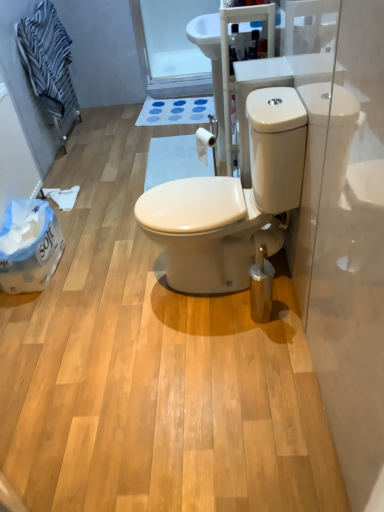
At what (x,y) coordinates should I click in order to perform the action: click on white matte toilet paper at upper center. Please return your answer as a coordinate pair (x, y). The width and height of the screenshot is (384, 512). Looking at the image, I should click on (204, 143).

This screenshot has height=512, width=384. What do you see at coordinates (204, 143) in the screenshot?
I see `white matte toilet paper at upper center` at bounding box center [204, 143].

Image resolution: width=384 pixels, height=512 pixels. In order to click on white plastic bag at left in this screenshot , I will do `click(29, 246)`.

Find the location of a particular element. This screenshot has width=384, height=512. blue rubber bath mat at center is located at coordinates (176, 111).

What is the approximate width of blue striped towel at upper left?

The width of blue striped towel at upper left is 6.80 inches.

The height and width of the screenshot is (512, 384). In order to click on white glossy toilet at center in this screenshot , I will do `click(231, 204)`.

Is white matte toilet paper at upper center wider or thinner than blue striped towel at upper left?

In the image, white matte toilet paper at upper center appears to be more narrow than blue striped towel at upper left.

Can you tell me how much white matte toilet paper at upper center and blue striped towel at upper left differ in facing direction?

white matte toilet paper at upper center and blue striped towel at upper left are facing 159 degrees away from each other.

Looking at this image, is white matte toilet paper at upper center bigger or smaller than blue striped towel at upper left?

Clearly, white matte toilet paper at upper center is smaller in size than blue striped towel at upper left.

Which is more to the left, white matte toilet paper at upper center or blue striped towel at upper left?

blue striped towel at upper left.

Does point (173, 26) come farther from viewer compared to point (11, 280)?

That is True.

Between transparent glass door at upper center and white plastic bag at left, which one has larger size?

white plastic bag at left.

Is transparent glass door at upper center with white plastic bag at left?

transparent glass door at upper center is not next to white plastic bag at left, and they're not touching.

Considering the relative sizes of blue striped towel at upper left and white plastic bag at left in the image provided, is blue striped towel at upper left wider than white plastic bag at left?

In fact, blue striped towel at upper left might be narrower than white plastic bag at left.

Who is taller, blue striped towel at upper left or white plastic bag at left?

blue striped towel at upper left is taller.

How far apart are blue striped towel at upper left and white plastic bag at left?

The distance of blue striped towel at upper left from white plastic bag at left is 4.00 feet.

From the image's perspective, is blue striped towel at upper left over white plastic bag at left?

Yes.

Does blue rubber bath mat at center appear on the right side of white glossy toilet at center?

Incorrect, blue rubber bath mat at center is not on the right side of white glossy toilet at center.

Based on the photo, which of these two, blue rubber bath mat at center or white glossy toilet at center, is bigger?

Bigger between the two is white glossy toilet at center.

Considering the sizes of blue rubber bath mat at center and white glossy toilet at center in the image, is blue rubber bath mat at center taller or shorter than white glossy toilet at center?

In the image, blue rubber bath mat at center appears to be shorter than white glossy toilet at center.

In the scene shown: Which point is more distant from viewer, (141, 111) or (196, 193)?

The point (141, 111) is farther.

Which object is closer to the camera, blue striped towel at upper left or white glossy toilet at center?

Positioned in front is white glossy toilet at center.

What's the angular difference between blue striped towel at upper left and white glossy toilet at center's facing directions?

The angle between the facing direction of blue striped towel at upper left and the facing direction of white glossy toilet at center is 176 degrees.

From their relative heights in the image, would you say blue striped towel at upper left is taller or shorter than white glossy toilet at center?

blue striped towel at upper left is shorter than white glossy toilet at center.

Considering the positions of points (49, 46) and (240, 266), is point (49, 46) closer to camera compared to point (240, 266)?

No, it is not.

Does blue rubber bath mat at center appear on the left side of white matte toilet paper at upper center?

Indeed, blue rubber bath mat at center is positioned on the left side of white matte toilet paper at upper center.

Would you say blue rubber bath mat at center is inside or outside white matte toilet paper at upper center?

blue rubber bath mat at center lies outside white matte toilet paper at upper center.

From a real-world perspective, is blue rubber bath mat at center positioned under white matte toilet paper at upper center based on gravity?

Yes, from a real-world perspective, blue rubber bath mat at center is under white matte toilet paper at upper center.

Is transparent glass door at upper center inside blue striped towel at upper left?

No, blue striped towel at upper left does not contain transparent glass door at upper center.

From a real-world perspective, is blue striped towel at upper left physically above transparent glass door at upper center?

Yes, from a real-world perspective, blue striped towel at upper left is above transparent glass door at upper center.

Which of these two, blue striped towel at upper left or transparent glass door at upper center, stands shorter?

Standing shorter between the two is blue striped towel at upper left.

Where is `toilet paper that is in front of the blue striped towel at upper left`? The height and width of the screenshot is (512, 384). toilet paper that is in front of the blue striped towel at upper left is located at coordinates (204, 143).

Locate an element on the screen. glass door behind the white plastic bag at left is located at coordinates [x=172, y=47].

Estimate the real-world distances between objects in this image. Which object is closer to white matte toilet paper at upper center, blue rubber bath mat at center or transparent glass door at upper center?

blue rubber bath mat at center is closer to white matte toilet paper at upper center.

Which object lies nearer to the anchor point blue rubber bath mat at center, blue striped towel at upper left or white matte toilet paper at upper center?

Based on the image, blue striped towel at upper left appears to be nearer to blue rubber bath mat at center.

Looking at the image, which one is located closer to blue rubber bath mat at center, transparent glass door at upper center or white plastic bag at left?

transparent glass door at upper center.

Looking at the image, which one is located closer to white plastic bag at left, transparent glass door at upper center or blue striped towel at upper left?

blue striped towel at upper left lies closer to white plastic bag at left than the other object.

Estimate the real-world distances between objects in this image. Which object is closer to white matte toilet paper at upper center, blue rubber bath mat at center or white glossy toilet at center?

white glossy toilet at center lies closer to white matte toilet paper at upper center than the other object.

From the image, which object appears to be farther from blue rubber bath mat at center, white plastic bag at left or white matte toilet paper at upper center?

white plastic bag at left is positioned further to the anchor blue rubber bath mat at center.

When comparing their distances from white glossy toilet at center, does blue rubber bath mat at center or blue striped towel at upper left seem closer?

Based on the image, blue striped towel at upper left appears to be nearer to white glossy toilet at center.

Which object lies nearer to the anchor point blue rubber bath mat at center, white plastic bag at left or blue striped towel at upper left?

blue striped towel at upper left is positioned closer to the anchor blue rubber bath mat at center.

At what (x,y) coordinates should I click in order to perform the action: click on glass door between white matte toilet paper at upper center and blue rubber bath mat at center along the z-axis. Please return your answer as a coordinate pair (x, y). This screenshot has height=512, width=384. Looking at the image, I should click on (x=172, y=47).

The height and width of the screenshot is (512, 384). I want to click on toilet paper between white plastic bag at left and white glossy toilet at center from left to right, so click(x=204, y=143).

Where is `laundry between white glossy toilet at center and transparent glass door at upper center from front to back`? laundry between white glossy toilet at center and transparent glass door at upper center from front to back is located at coordinates click(48, 62).

At what (x,y) coordinates should I click in order to perform the action: click on laundry that lies between transparent glass door at upper center and white plastic bag at left from top to bottom. Please return your answer as a coordinate pair (x, y). This screenshot has height=512, width=384. Looking at the image, I should click on (48, 62).